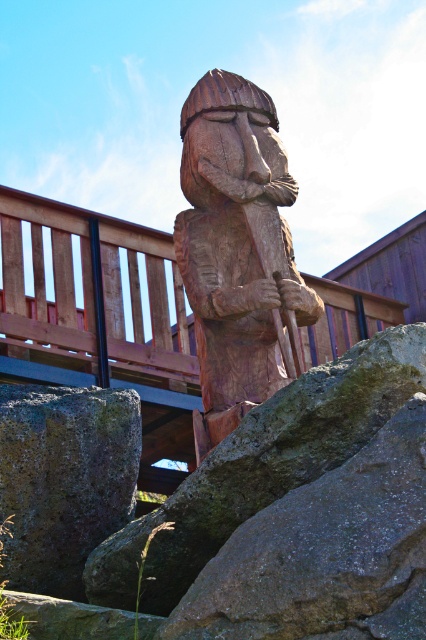
You are a visitor at a park and see the wooden statue at center and the gray rough stone at lower left. Which object is closer to you?

The wooden statue at center is closer to you because it is positioned over the gray rough stone at lower left, indicating it is in front of it.

You are a hiker who wants to place a 1.2 meter long backpack on the ground between the wooden statue at center and the rough textured rock at center. Given the space between them, will the backpack fit without overlapping either object?

The wooden statue at center is smaller than the rough textured rock at center, but the exact distance between them isn

You are a hiker who wants to cross the wooden bridge in the image. There is a rough textured rock at center located at point [261,467]. Would you step on it to cross the bridge safely?

The rough textured rock at center is located at point [261,467], so stepping on it would be safe as it is part of the bridge structure.